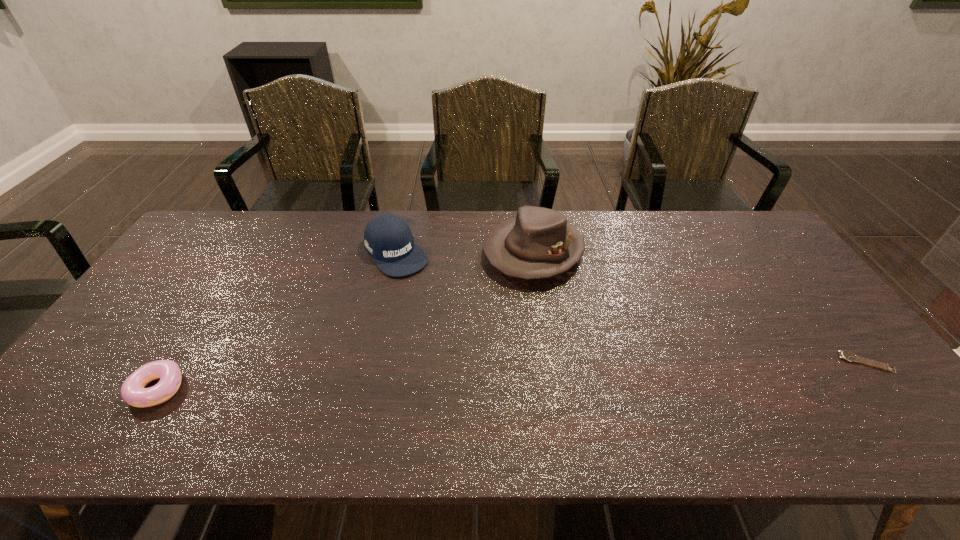
Identify which object is the closest to the shortest object. Please provide its 2D coordinates. Your answer should be formatted as a tuple, i.e. [(x, y)], where the tuple contains the x and y coordinates of a point satisfying the conditions above.

[(538, 243)]

I want to click on the closest object to the second object from left to right, so click(538, 243).

This screenshot has height=540, width=960. In order to click on free space in the image that satisfies the following two spatial constraints: 1. on the back side of the third object from left to right; 2. on the right side of the third shortest object in this screenshot , I will do `click(396, 252)`.

At what (x,y) coordinates should I click in order to perform the action: click on free space that satisfies the following two spatial constraints: 1. on the back side of the watch; 2. on the right side of the doughnut. Please return your answer as a coordinate pair (x, y). This screenshot has height=540, width=960. Looking at the image, I should click on (175, 362).

This screenshot has width=960, height=540. In order to click on blank space that satisfies the following two spatial constraints: 1. on the front side of the third object from right to left; 2. on the left side of the shortest object in this screenshot , I will do `click(372, 362)`.